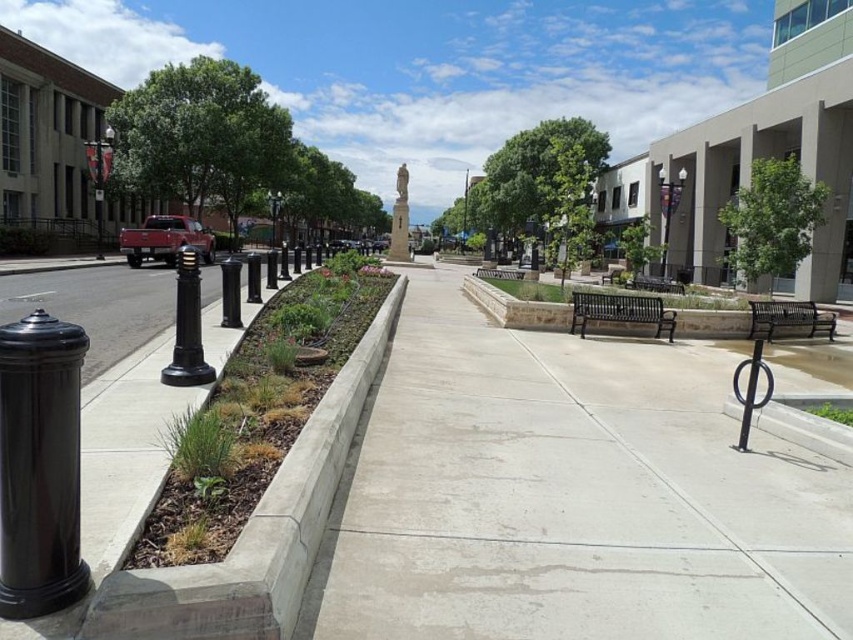
Question: From the image, what is the correct spatial relationship of concrete at center in relation to black polished bollard at left?

Choices:
 (A) left
 (B) right

Answer: (B)

Question: Is metallic silver lamp post at upper right further to camera compared to black metal lamp post at center?

Choices:
 (A) yes
 (B) no

Answer: (B)

Question: Among these points, which one is farthest from the camera?

Choices:
 (A) (181, 378)
 (B) (111, 150)
 (C) (404, 227)
 (D) (64, 408)

Answer: (C)

Question: Is black polished bollard at left wider than stone statue at center?

Choices:
 (A) no
 (B) yes

Answer: (B)

Question: Which point is closer to the camera taking this photo?

Choices:
 (A) (380, 385)
 (B) (108, 140)
 (C) (662, 204)

Answer: (A)

Question: Based on their relative distances, which object is nearer to the concrete at left?

Choices:
 (A) black polished bollard at left
 (B) concrete at center
 (C) black polished pillar at left

Answer: (C)